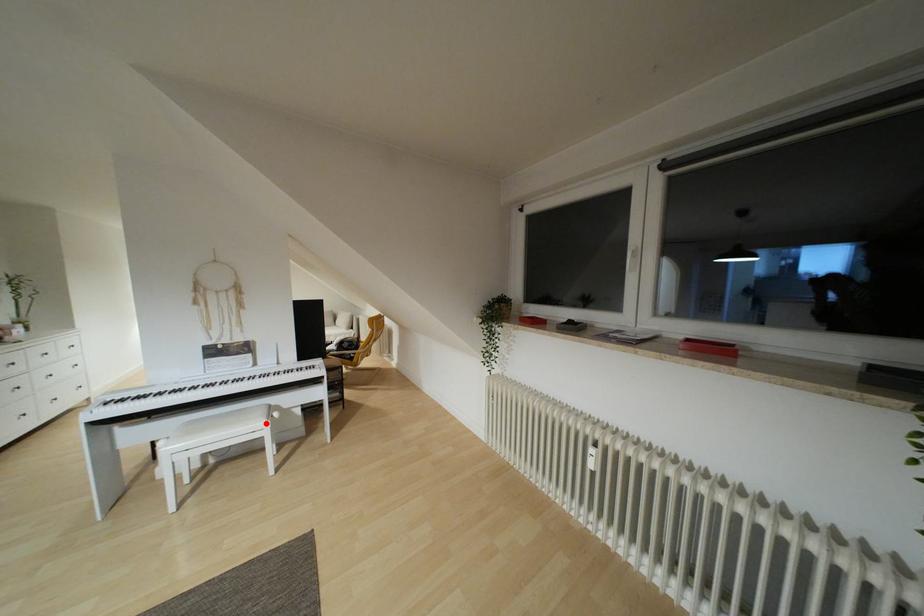
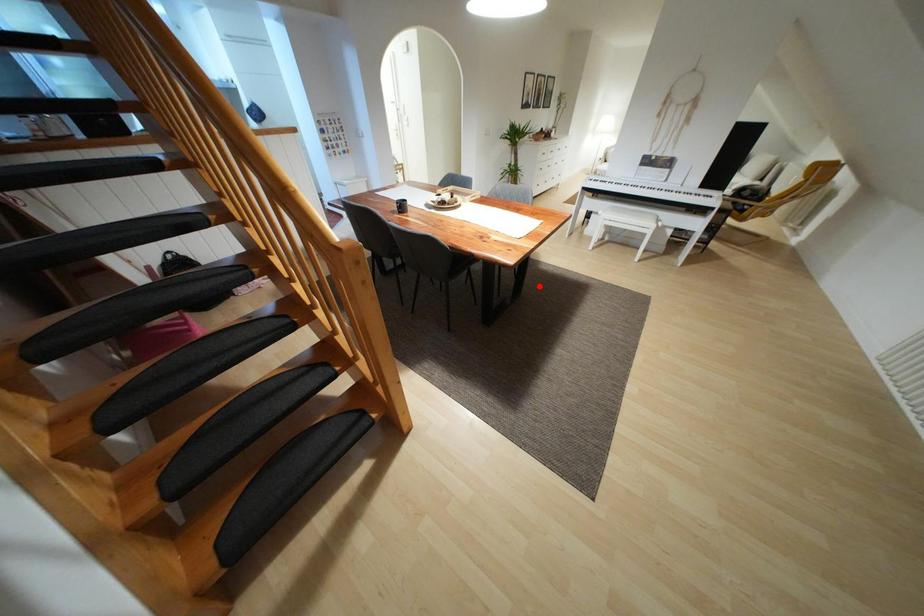
I am providing you with two images of the same scene from different viewpoints. A red point is marked on the first image and another point is marked on the second image. Are the points marked in image1 and image2 representing the same 3D position?

No